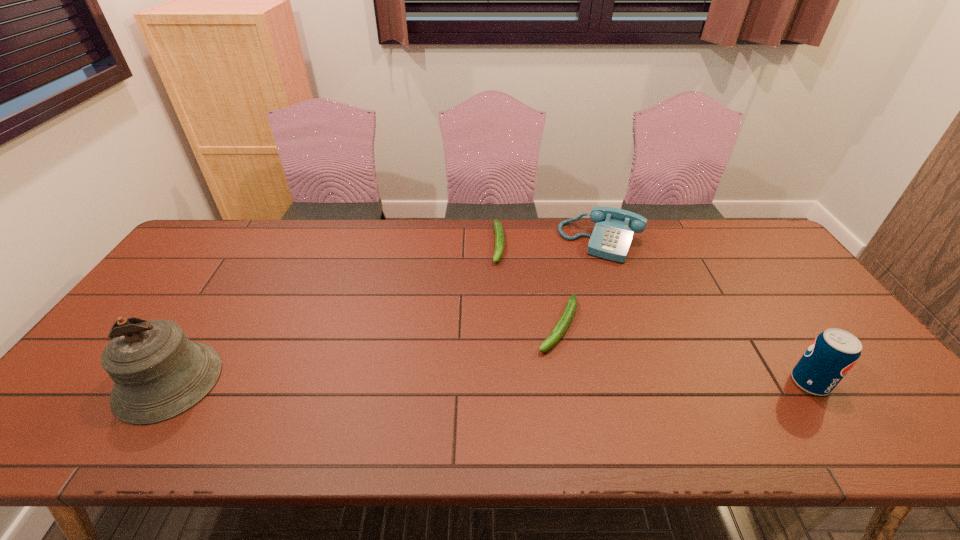
Where is `free spot on the desktop that is between the tallest object and the rightmost object and is positioned on the front-facing side of the fourth object from right to left`? The height and width of the screenshot is (540, 960). free spot on the desktop that is between the tallest object and the rightmost object and is positioned on the front-facing side of the fourth object from right to left is located at coordinates (496, 382).

Where is `free space on the desktop that is between the tallest object and the rightmost object and is positioned on the front-facing side of the right zucchini`? This screenshot has width=960, height=540. free space on the desktop that is between the tallest object and the rightmost object and is positioned on the front-facing side of the right zucchini is located at coordinates (524, 382).

You are a GUI agent. You are given a task and a screenshot of the screen. Output one action in this format:
    pyautogui.click(x=<x>, y=<y>)
    Task: Click on the vacant space on the desktop that is between the leftmost object and the pop and is positioned on the dial of the telephone
    This screenshot has height=540, width=960.
    Given the screenshot: What is the action you would take?
    pyautogui.click(x=540, y=382)